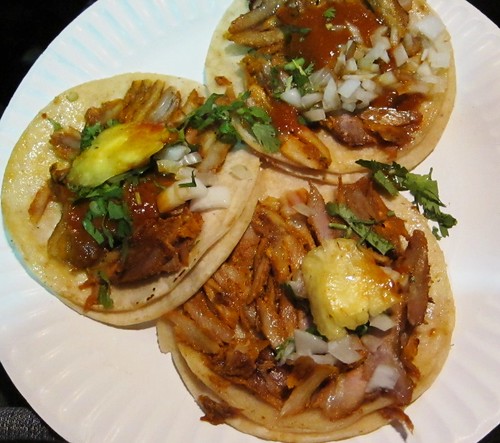
Identify the location of rim area of plate. Image resolution: width=500 pixels, height=443 pixels. (31, 406), (8, 375).